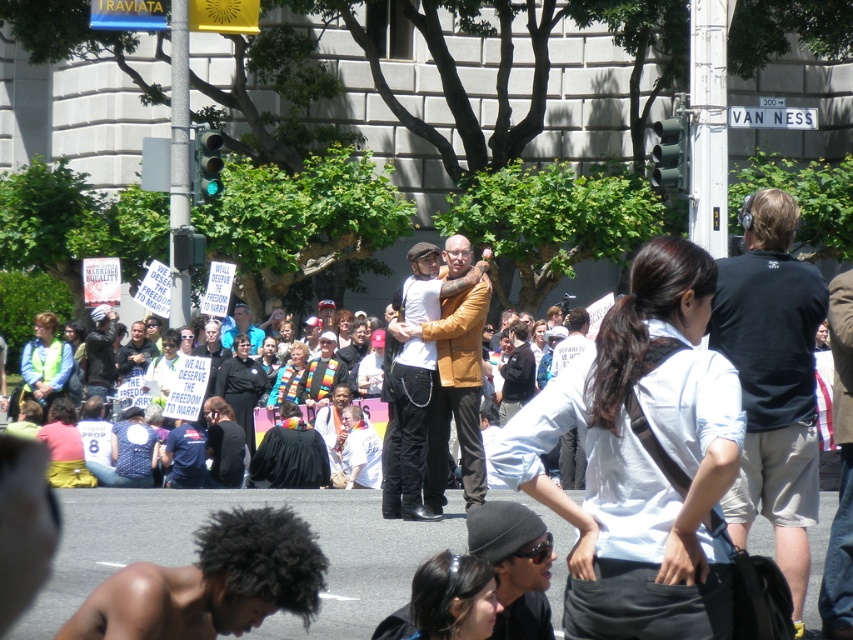
You are standing in the plaza looking at the demonstration. There are two points marked in the image, one at coordinates point (445, 336) and the other at point (105, 330). Which point is closer to you?

Point (445, 336) is closer to the viewer than point (105, 330).